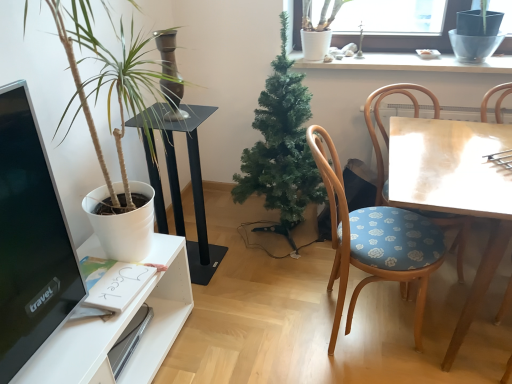
Question: Considering the relative sizes of wooden chair with floral cushion at right, placed as the second chair when sorted from left to right, and wooden table at right in the image provided, is wooden chair with floral cushion at right, placed as the second chair when sorted from left to right, bigger than wooden table at right?

Choices:
 (A) no
 (B) yes

Answer: (A)

Question: Does wooden chair with floral cushion at right, placed as the first chair when sorted from right to left, have a smaller size compared to wooden table at right?

Choices:
 (A) no
 (B) yes

Answer: (B)

Question: Is wooden chair with floral cushion at right, placed as the first chair when sorted from right to left, behind wooden table at right?

Choices:
 (A) yes
 (B) no

Answer: (A)

Question: From a real-world perspective, is wooden chair with floral cushion at right, placed as the first chair when sorted from right to left, located beneath wooden table at right?

Choices:
 (A) no
 (B) yes

Answer: (A)

Question: Does wooden chair with floral cushion at right, placed as the first chair when sorted from right to left, have a lesser width compared to wooden table at right?

Choices:
 (A) yes
 (B) no

Answer: (A)

Question: In the image, is wooden chair with floral cushion at right, placed as the first chair when sorted from right to left, positioned in front of or behind green artificial tree at center, which is counted as the 1th houseplant, starting from the right?

Choices:
 (A) front
 (B) behind

Answer: (A)

Question: In terms of width, does wooden chair with floral cushion at right, placed as the second chair when sorted from left to right, look wider or thinner when compared to green artificial tree at center, which is counted as the 1th houseplant, starting from the right?

Choices:
 (A) wide
 (B) thin

Answer: (A)

Question: From a real-world perspective, is wooden chair with floral cushion at right, placed as the first chair when sorted from right to left, positioned above or below green artificial tree at center, positioned as the 2th houseplant in left-to-right order?

Choices:
 (A) below
 (B) above

Answer: (A)

Question: Is wooden chair with floral cushion at right, placed as the second chair when sorted from left to right, inside the boundaries of green artificial tree at center, which is counted as the 1th houseplant, starting from the right, or outside?

Choices:
 (A) outside
 (B) inside

Answer: (A)

Question: Based on their sizes in the image, would you say black glossy computer monitor at left is bigger or smaller than black glass table at center?

Choices:
 (A) big
 (B) small

Answer: (B)

Question: Would you say black glossy computer monitor at left is to the left or to the right of black glass table at center in the picture?

Choices:
 (A) right
 (B) left

Answer: (B)

Question: In terms of width, does black glossy computer monitor at left look wider or thinner when compared to black glass table at center?

Choices:
 (A) thin
 (B) wide

Answer: (A)

Question: From their relative heights in the image, would you say black glossy computer monitor at left is taller or shorter than black glass table at center?

Choices:
 (A) tall
 (B) short

Answer: (B)

Question: Considering the positions of point (x=25, y=97) and point (x=375, y=200), is point (x=25, y=97) closer or farther from the camera than point (x=375, y=200)?

Choices:
 (A) farther
 (B) closer

Answer: (B)

Question: From a real-world perspective, is black glossy computer monitor at left positioned above or below wooden chair with floral cushion at right, placed as the second chair when sorted from left to right?

Choices:
 (A) above
 (B) below

Answer: (A)